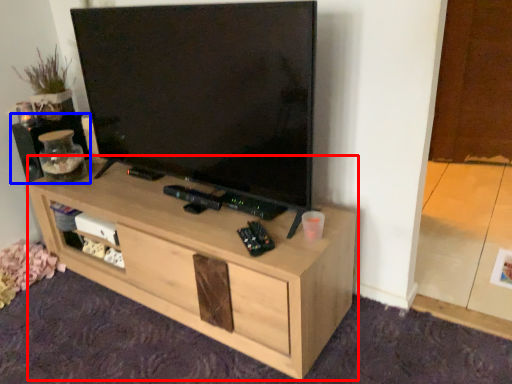
Question: Which object appears closest to the camera in this image, desk (highlighted by a red box) or speaker (highlighted by a blue box)?

Choices:
 (A) desk
 (B) speaker

Answer: (A)